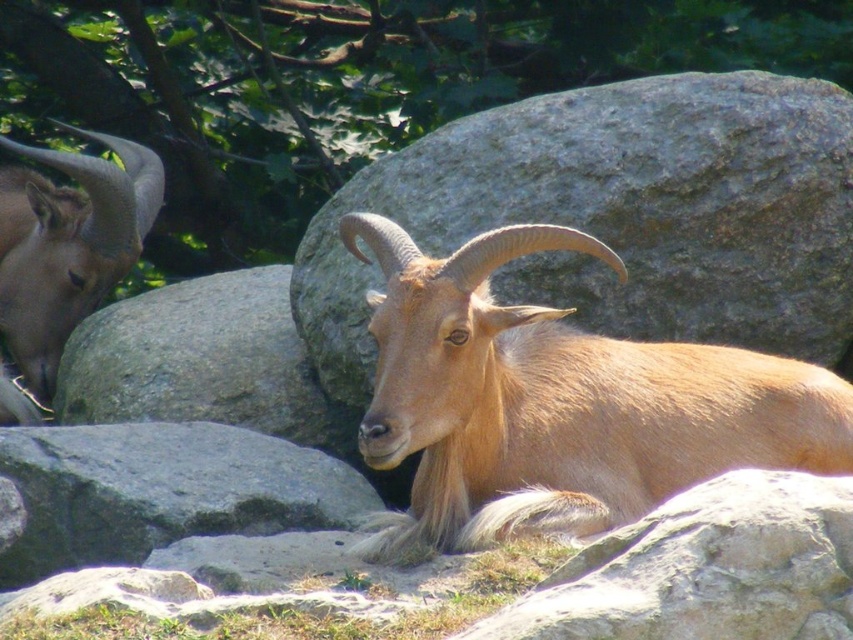
Between gray rough rock at lower right and brown woolen goat at left, which one has more height?

brown woolen goat at left

Between gray rough rock at lower right and brown woolen goat at left, which one appears on the right side from the viewer's perspective?

gray rough rock at lower right

The height and width of the screenshot is (640, 853). What do you see at coordinates (705, 570) in the screenshot? I see `gray rough rock at lower right` at bounding box center [705, 570].

The image size is (853, 640). Identify the location of gray rough rock at lower right. (705, 570).

Consider the image. Is gray rock at center above gray rough rock at lower left?

Correct, gray rock at center is located above gray rough rock at lower left.

Which is below, gray rock at center or gray rough rock at lower left?

gray rough rock at lower left

Between point (730, 339) and point (100, 520), which one is positioned in front?

Point (100, 520) is in front.

Find the location of a particular element. gray rock at center is located at coordinates (619, 216).

The width and height of the screenshot is (853, 640). Describe the element at coordinates (558, 403) in the screenshot. I see `golden fur goat at center` at that location.

Is point (483, 237) less distant than point (726, 620)?

That is False.

Identify the location of golden fur goat at center. (558, 403).